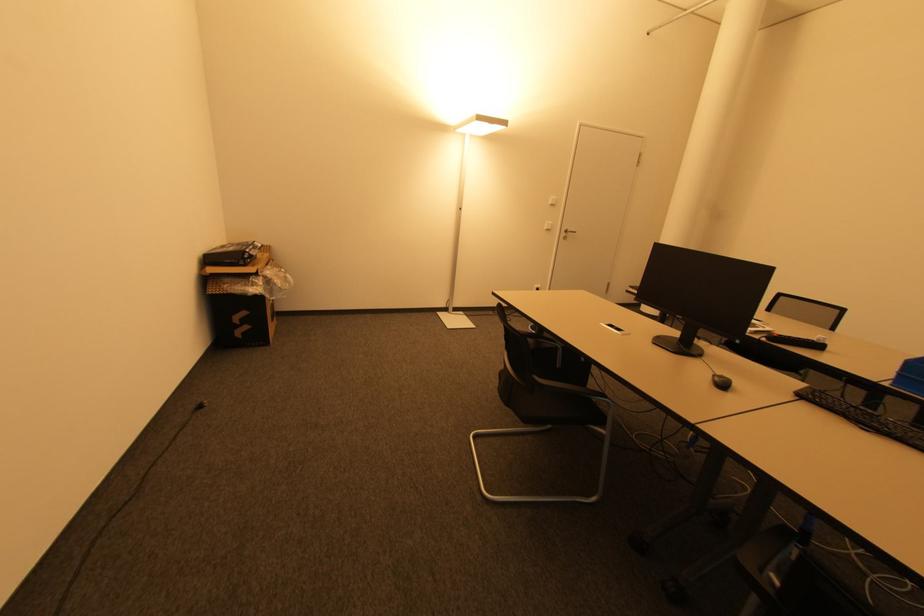
Which object does [238,318] point to?

This point indicates the black cardboard box.